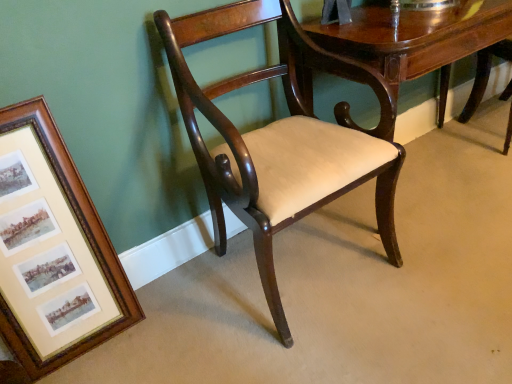
At what (x,y) coordinates should I click in order to perform the action: click on vacant region below mahogany wood table at center (from a real-world perspective). Please return your answer as a coordinate pair (x, y). Looking at the image, I should click on (423, 172).